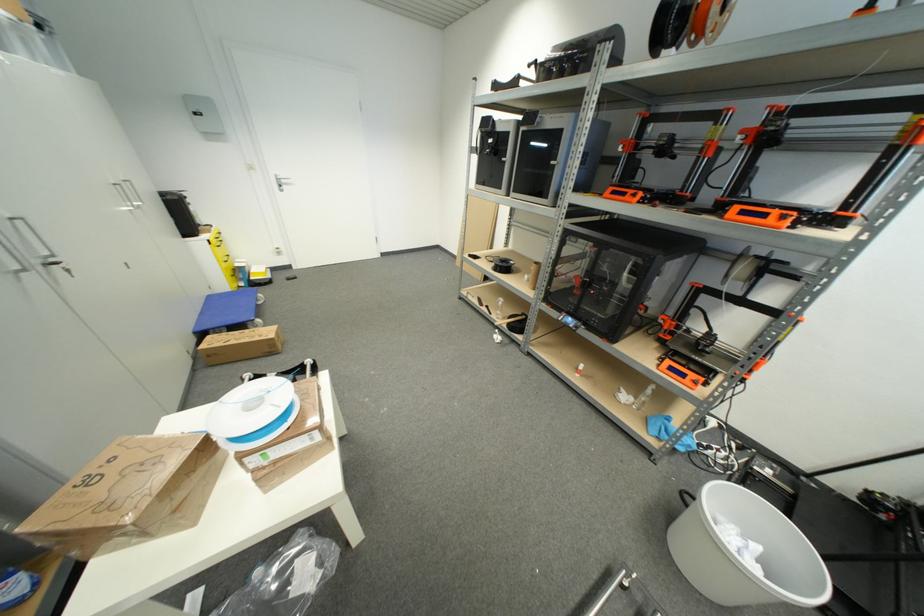
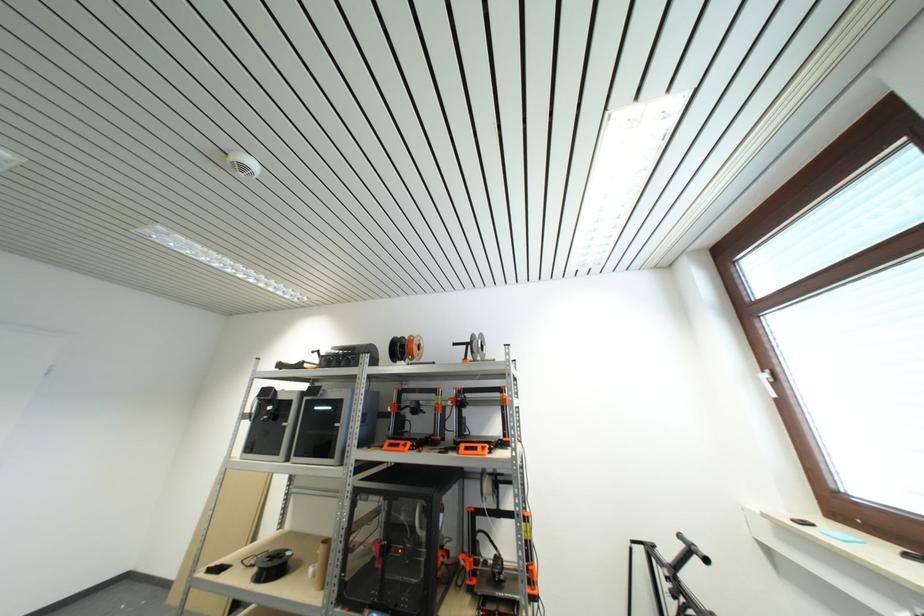
Locate, in the second image, the point that corresponds to point 508,267 in the first image.

(281, 565)